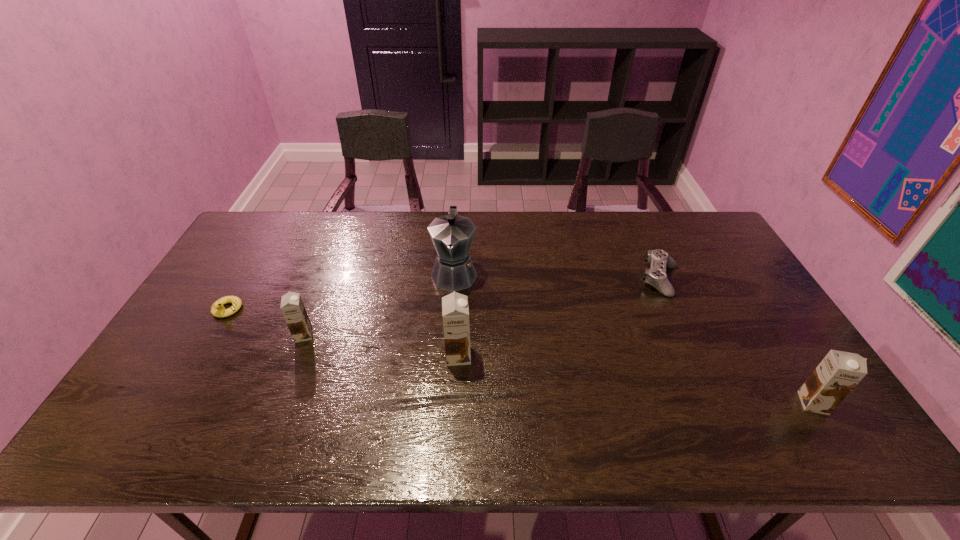
To make them evenly spaced by inserting another chocolate_milk among them, please locate a free space for this new chocolate_milk. Please provide its 2D coordinates. Your answer should be formatted as a tuple, i.e. [(x, y)], where the tuple contains the x and y coordinates of a point satisfying the conditions above.

[(627, 378)]